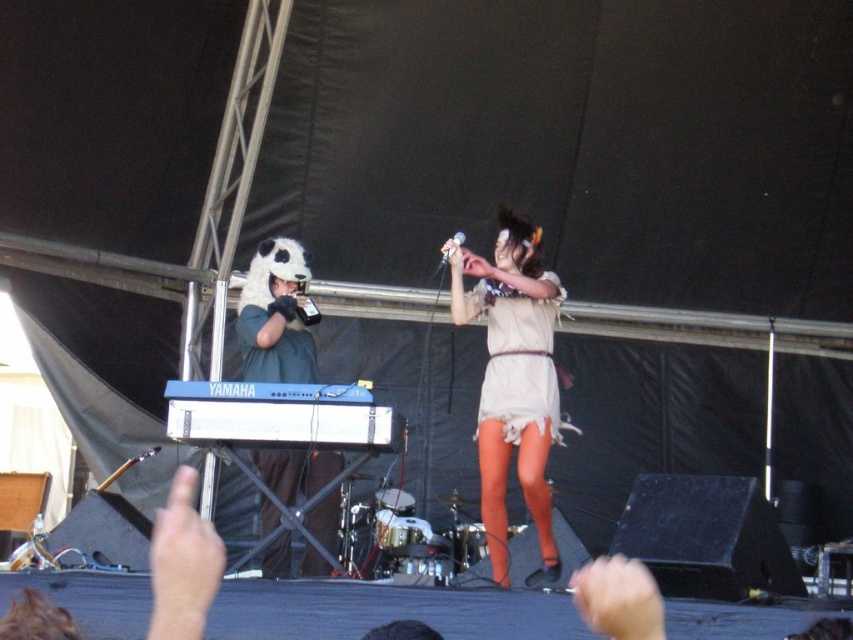
Question: Does white plush panda hat at left have a lesser width compared to beige fabric dress at center?

Choices:
 (A) yes
 (B) no

Answer: (A)

Question: Considering the real-world distances, which object is closest to the light beige fabric dress at center?

Choices:
 (A) white plastic keyboard at center
 (B) white plush panda hat at left
 (C) beige fabric dress at center

Answer: (C)

Question: Which point appears farthest from the camera in this image?

Choices:
 (A) (300, 484)
 (B) (267, 432)
 (C) (525, 330)
 (D) (548, 541)

Answer: (C)

Question: Which point is closer to the camera taking this photo?

Choices:
 (A) (517, 337)
 (B) (241, 420)
 (C) (305, 317)
 (D) (537, 310)

Answer: (B)

Question: From the image, what is the correct spatial relationship of light beige fabric dress at center in relation to beige fabric dress at center?

Choices:
 (A) right
 (B) left

Answer: (B)

Question: Is light beige fabric dress at center to the left of white plastic keyboard at center from the viewer's perspective?

Choices:
 (A) yes
 (B) no

Answer: (B)